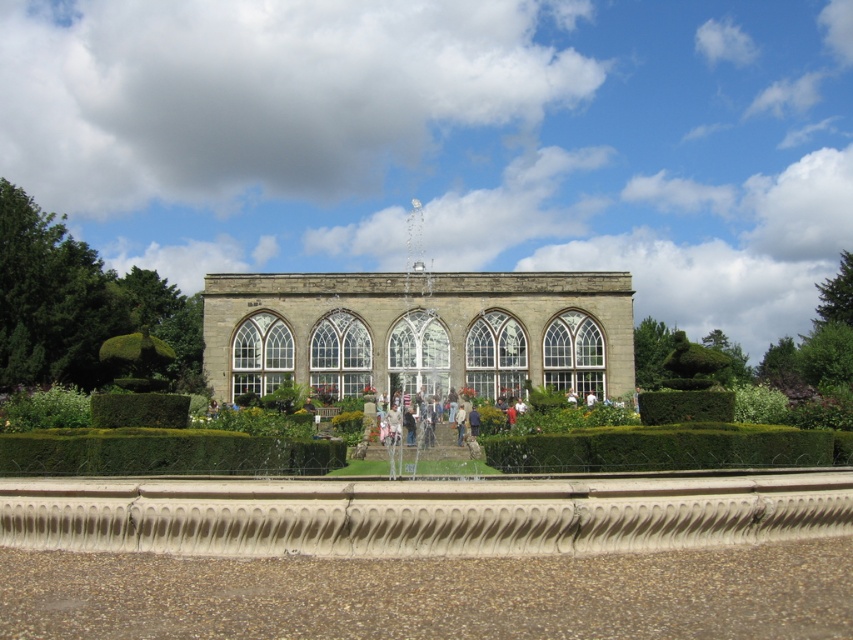
Question: Which point appears farthest from the camera in this image?

Choices:
 (A) [276, 342]
 (B) [251, 451]

Answer: (A)

Question: Observing the image, what is the correct spatial positioning of green leafy hedge at center in reference to green leafy hedge at lower center?

Choices:
 (A) above
 (B) below

Answer: (B)

Question: Is green leafy hedge at center to the left of green leafy hedge at lower center from the viewer's perspective?

Choices:
 (A) no
 (B) yes

Answer: (A)

Question: Among these points, which one is farthest from the camera?

Choices:
 (A) (141, 396)
 (B) (49, 436)

Answer: (A)

Question: Among these objects, which one is farthest from the camera?

Choices:
 (A) green leafy hedge at lower left
 (B) stone glass palace at center

Answer: (B)

Question: Can you confirm if green leafy hedge at center is positioned to the right of green leafy hedge at lower center?

Choices:
 (A) no
 (B) yes

Answer: (B)